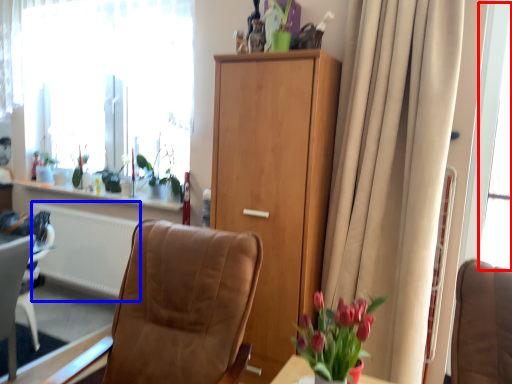
Question: Among these objects, which one is farthest to the camera, window screen (highlighted by a red box) or radiator (highlighted by a blue box)?

Choices:
 (A) window screen
 (B) radiator

Answer: (B)